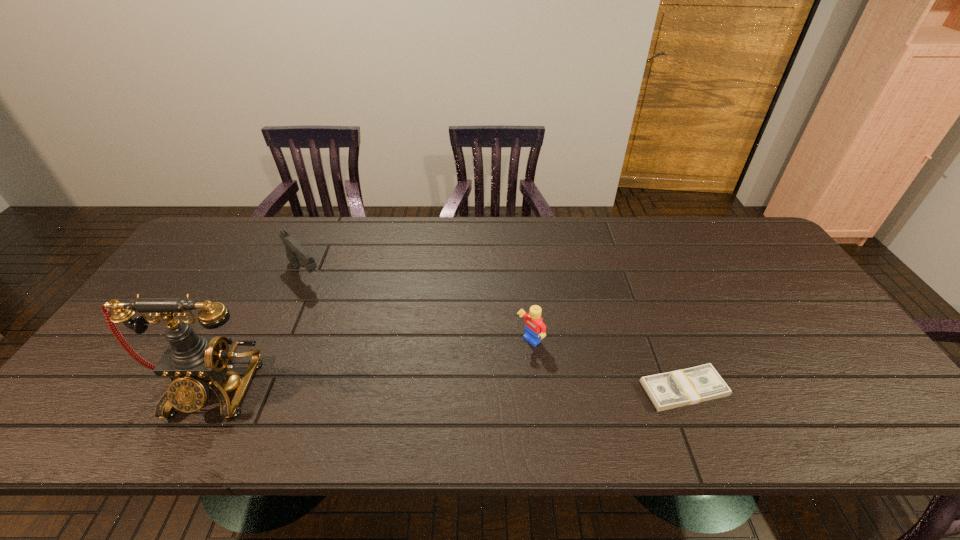
Find the location of a particular element. vacant space on the desktop that is between the tallest object and the rightmost object and is positioned at the barrel of the pistol is located at coordinates (415, 388).

Find the location of a particular element. This screenshot has height=540, width=960. free space on the desktop that is between the tallest object and the rightmost object and is positioned on the face of the second farthest object is located at coordinates (469, 388).